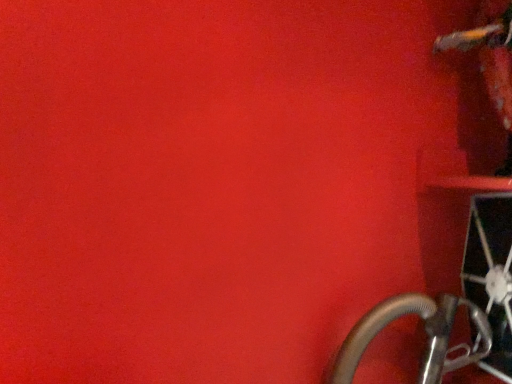
This screenshot has height=384, width=512. What do you see at coordinates (490, 275) in the screenshot?
I see `metallic silver wheel at lower right` at bounding box center [490, 275].

The image size is (512, 384). What are the coordinates of `metallic silver wheel at lower right` in the screenshot? It's located at (490, 275).

What are the coordinates of `metallic silver wheel at lower right` in the screenshot? It's located at (490, 275).